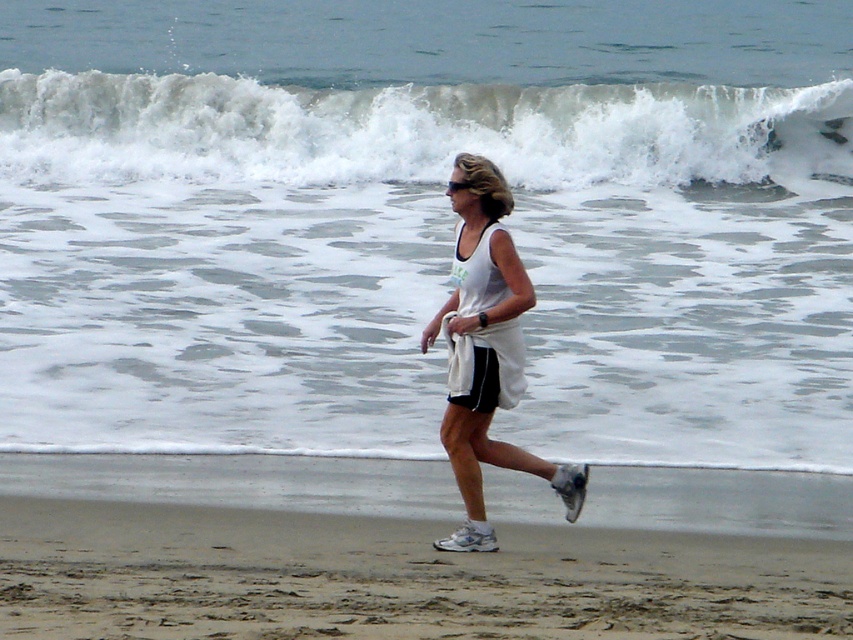
You are a photographer trying to capture the person jogging on the beach. Since both the white frothy wave at upper center and the white fabric tank top at center are white in color, how can you ensure the wave appears distinct from the tank top in your photo?

The white frothy wave at upper center is positioned over the white fabric tank top at center, so you can adjust your camera angle to capture the wave above the tank top, creating a clear visual separation between them.

Based on the photo, you are a drone operator trying to capture a photo of the beach scene. The sandy brown at lower center is located at coordinates point 0.903, 0.465. If you want to focus on this area, which direction should you adjust the camera to point towards?

The sandy brown at lower center is located at point (396, 577), so you should adjust the camera to point towards the lower center direction to focus on this area.

Based on the photo, you are a drone operator trying to capture the best aerial shot of the beach scene. You have two points marked on your screen at coordinates point [730,134] and point [498,374]. Which point is closer to the camera to ensure the subject is in focus?

Point [730,134] is further to the viewer than point [498,374], so the point [498,374] is closer to the camera and should be focused on for clarity.